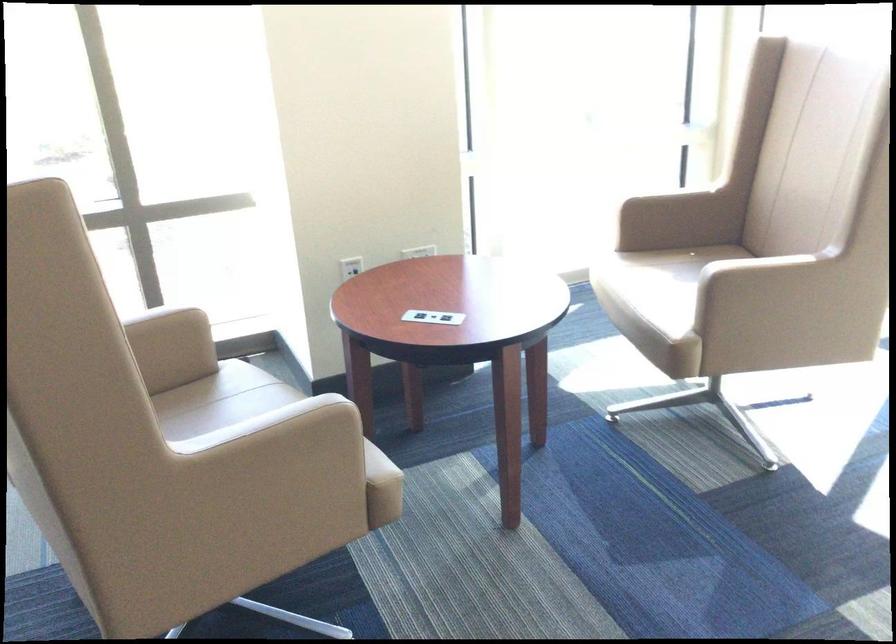
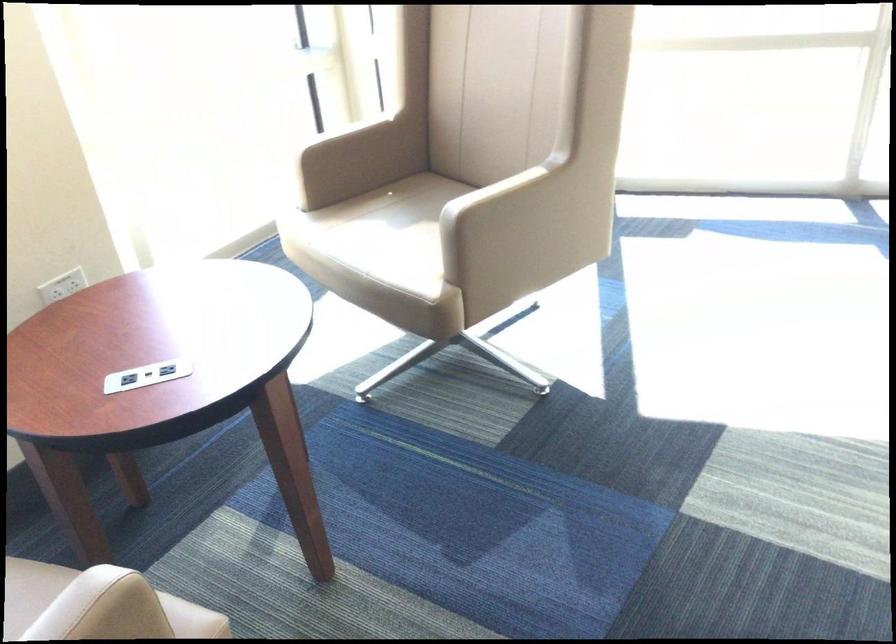
Question: The images are taken continuously from a first-person perspective. In which direction is your viewpoint rotating?

Choices:
 (A) Left
 (B) Right
 (C) Up
 (D) Down

Answer: (B)